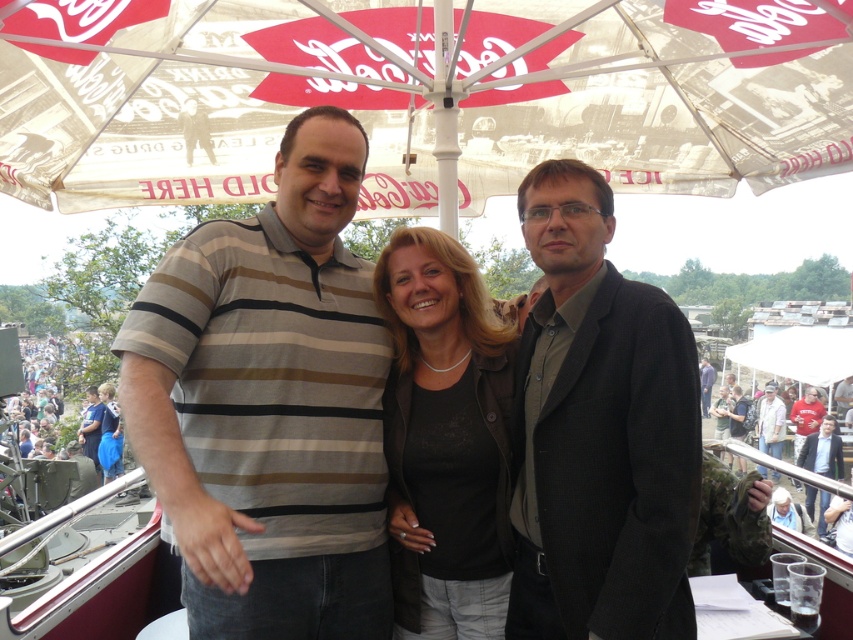
Between dark gray woolen jacket at center and dark gray suit at center, which one has more height?

Standing taller between the two is dark gray suit at center.

Is dark gray woolen jacket at center below dark gray suit at center?

Actually, dark gray woolen jacket at center is above dark gray suit at center.

Where is `dark gray woolen jacket at center`? dark gray woolen jacket at center is located at coordinates (599, 432).

Is dark gray woolen jacket at center in front of light brown leather jacket at center?

Yes, dark gray woolen jacket at center is in front of light brown leather jacket at center.

Measure the distance between dark gray woolen jacket at center and light brown leather jacket at center.

3.27 meters

Which is in front, point (657, 305) or point (770, 419)?

Point (657, 305) is in front.

I want to click on dark gray woolen jacket at center, so click(x=599, y=432).

Is dark gray woolen jacket at center positioned before black matte jacket at center?

Yes, dark gray woolen jacket at center is in front of black matte jacket at center.

Is dark gray woolen jacket at center bigger than black matte jacket at center?

Correct, dark gray woolen jacket at center is larger in size than black matte jacket at center.

You are a GUI agent. You are given a task and a screenshot of the screen. Output one action in this format:
    pyautogui.click(x=<x>, y=<y>)
    Task: Click on the dark gray woolen jacket at center
    The width and height of the screenshot is (853, 640).
    Given the screenshot: What is the action you would take?
    pyautogui.click(x=599, y=432)

Find the location of a particular element. Image resolution: width=853 pixels, height=640 pixels. dark gray woolen jacket at center is located at coordinates (599, 432).